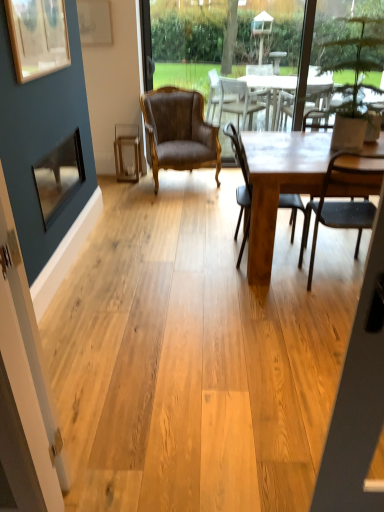
At what (x,y) coordinates should I click in order to perform the action: click on free space between brown leather armchair at center, acting as the 1th chair starting from the left, and transparent glass screen door at left. Please return your answer as a coordinate pair (x, y). Image resolution: width=384 pixels, height=512 pixels. Looking at the image, I should click on (148, 263).